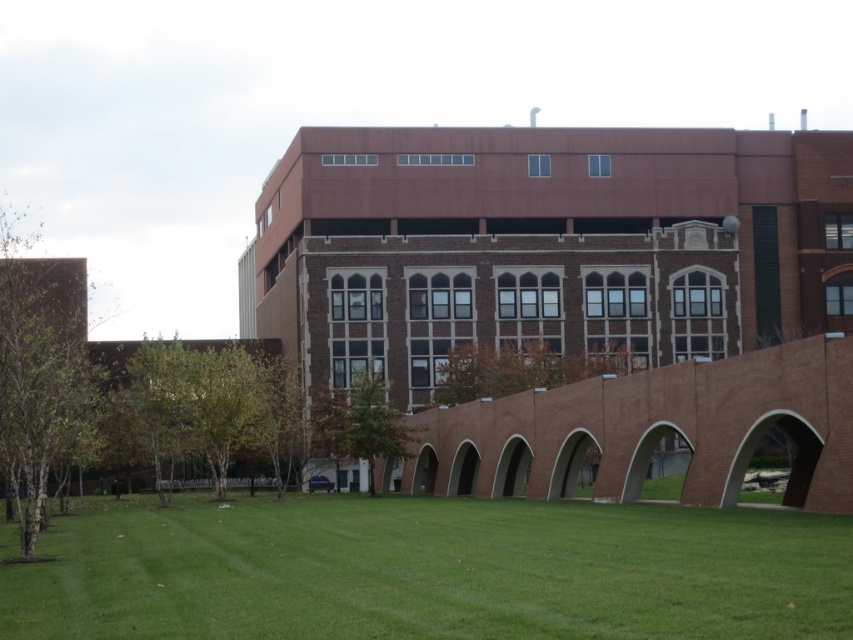
Question: Can you confirm if green leafy tree at left is positioned above green leafy tree at center?

Choices:
 (A) no
 (B) yes

Answer: (B)

Question: Which point is farther to the camera?

Choices:
 (A) green leafy tree at center
 (B) green grass at lower center
 (C) green leafy tree at left

Answer: (A)

Question: Is the position of green grass at lower center more distant than that of green leafy tree at center?

Choices:
 (A) no
 (B) yes

Answer: (A)

Question: Can you confirm if green leafy tree at left is bigger than green leafy tree at center?

Choices:
 (A) no
 (B) yes

Answer: (B)

Question: Which object is farther from the camera taking this photo?

Choices:
 (A) green grass at lower center
 (B) green leafy tree at center
 (C) green leafy tree at left

Answer: (B)

Question: Which point is farther to the camera?

Choices:
 (A) pyautogui.click(x=4, y=262)
 (B) pyautogui.click(x=389, y=573)
 (C) pyautogui.click(x=366, y=388)

Answer: (C)